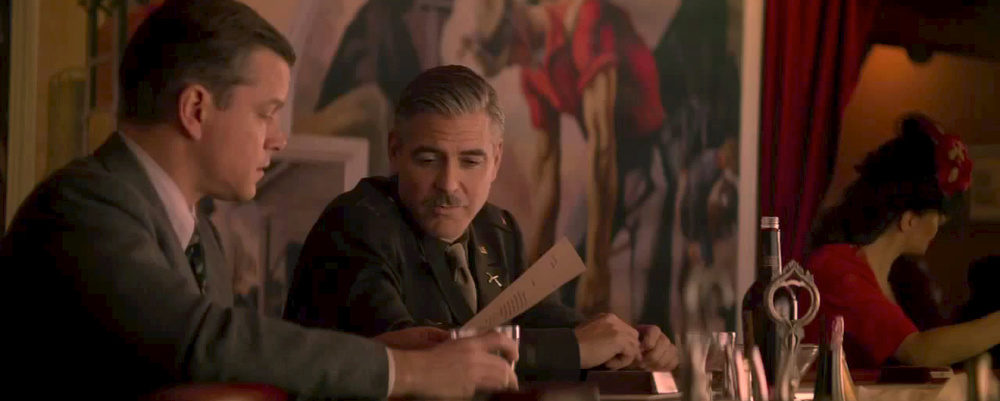
At what (x,y) coordinates should I click in order to perform the action: click on table. Please return your answer as a coordinate pair (x, y). Looking at the image, I should click on (888, 385).